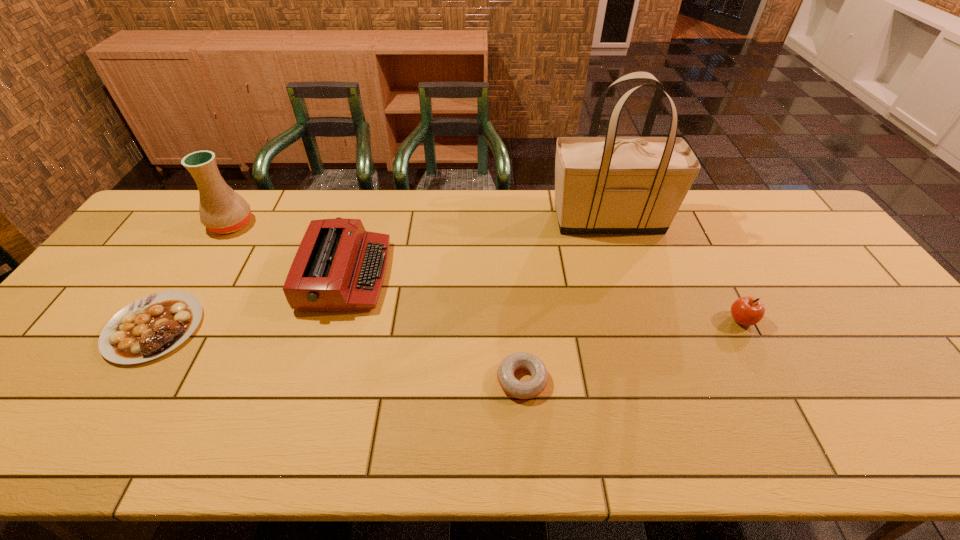
The width and height of the screenshot is (960, 540). In the image, there is a desktop. Find the location of `vacant space at the left edge`. vacant space at the left edge is located at coordinates (56, 354).

This screenshot has width=960, height=540. What are the coordinates of `vacant space at the right edge of the desktop` in the screenshot? It's located at (871, 360).

Where is `free region at the near left corner of the desktop`? free region at the near left corner of the desktop is located at coordinates pos(36,447).

Find the location of `free space between the fifth shortest object and the apple`. free space between the fifth shortest object and the apple is located at coordinates (486, 272).

At what (x,y) coordinates should I click in order to perform the action: click on empty location between the rightmost object and the shopping bag. Please return your answer as a coordinate pair (x, y). The width and height of the screenshot is (960, 540). Looking at the image, I should click on coord(675,270).

Find the location of a particular element. free space between the rightmost object and the fourth object from right to left is located at coordinates (543, 298).

Locate an element on the screen. The width and height of the screenshot is (960, 540). empty location between the tallest object and the typewriter is located at coordinates (477, 247).

Locate an element on the screen. The height and width of the screenshot is (540, 960). free area in between the steak and the pottery is located at coordinates (193, 276).

Identify the location of empty space that is in between the shopping bag and the apple. (675, 270).

I want to click on empty space that is in between the second object from right to left and the fifth shortest object, so click(420, 222).